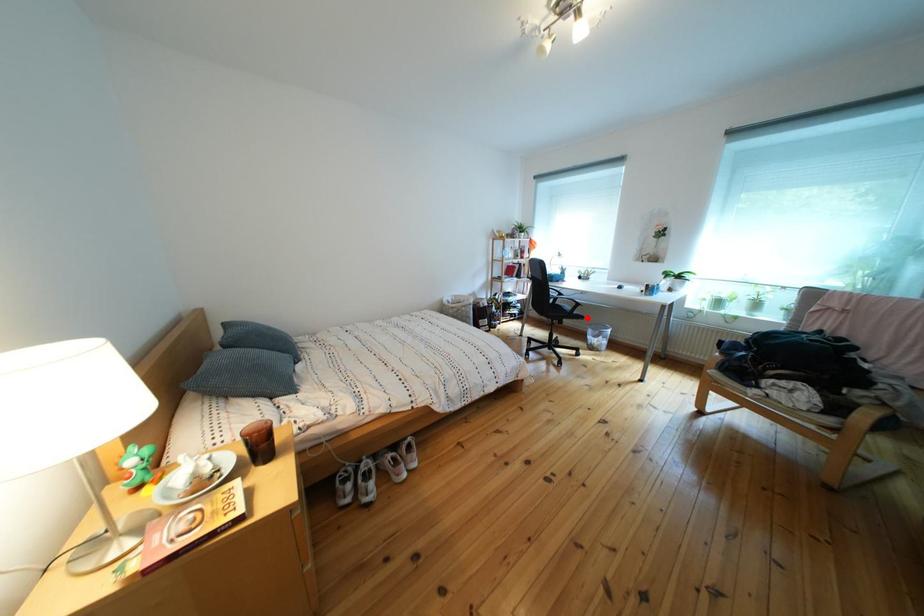
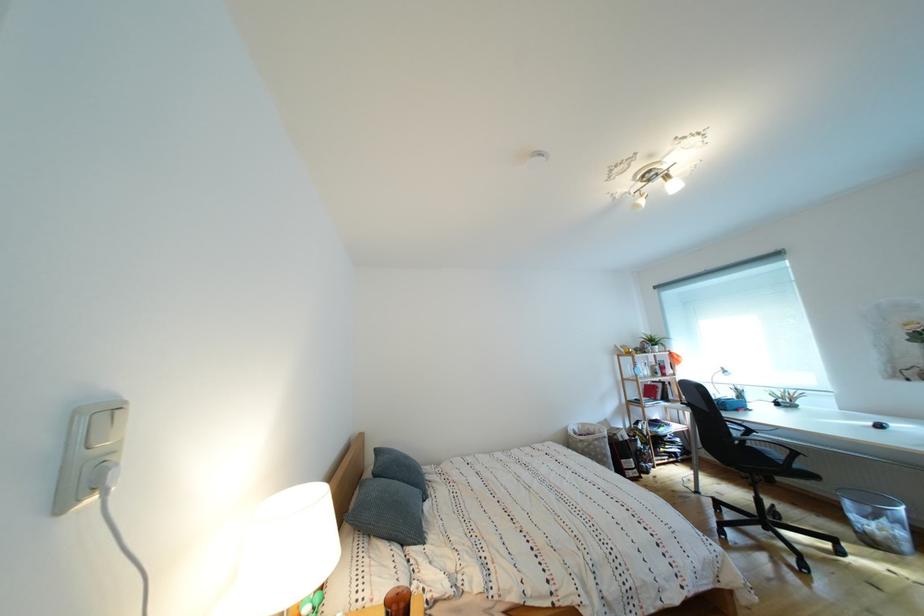
Locate, in the second image, the point that corresponds to the highlighted location in the first image.

(808, 472)